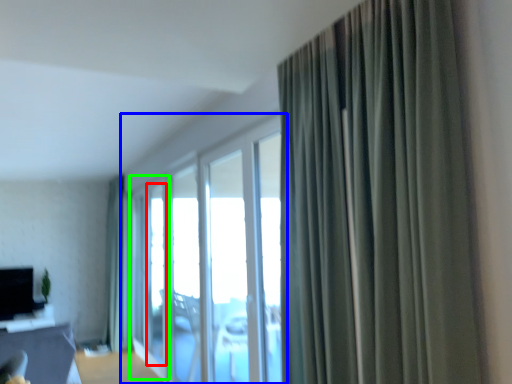
Question: Which object is the closest to the window screen (highlighted by a red box)? Choose among these: window (highlighted by a blue box) or screen door (highlighted by a green box).

Choices:
 (A) window
 (B) screen door

Answer: (B)